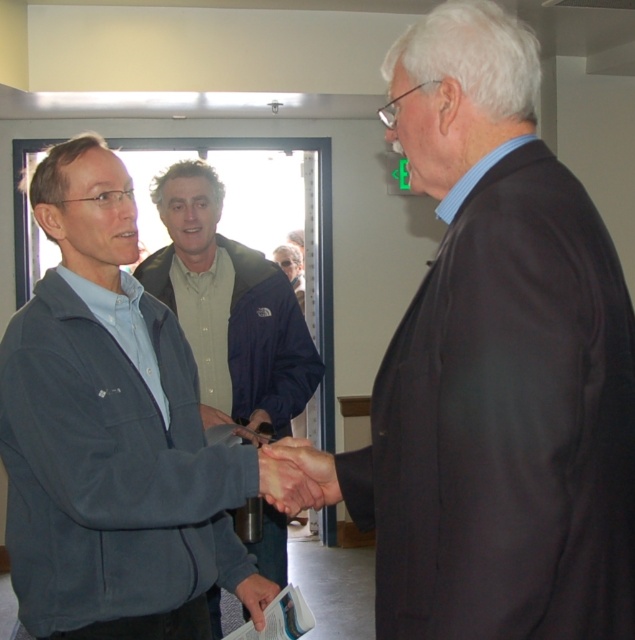
Question: Does dark gray suit at right have a smaller size compared to smooth skin handshake at center?

Choices:
 (A) no
 (B) yes

Answer: (A)

Question: Estimate the real-world distances between objects in this image. Which object is farther from the dark gray fleece jacket at left?

Choices:
 (A) white paper at center
 (B) smooth skin handshake at center
 (C) matte blue jacket at center
 (D) dark gray suit at right

Answer: (C)

Question: Is matte blue jacket at center thinner than smooth skin handshake at center?

Choices:
 (A) no
 (B) yes

Answer: (A)

Question: Is dark gray suit at right further to camera compared to dark gray fleece jacket at left?

Choices:
 (A) yes
 (B) no

Answer: (B)

Question: Based on their relative distances, which object is farther from the smooth skin handshake at center?

Choices:
 (A) dark gray fleece jacket at left
 (B) matte blue jacket at center

Answer: (B)

Question: Which point is farther from the camera taking this photo?

Choices:
 (A) (290, 332)
 (B) (264, 586)
 (C) (518, 561)
 (D) (147, 577)

Answer: (A)